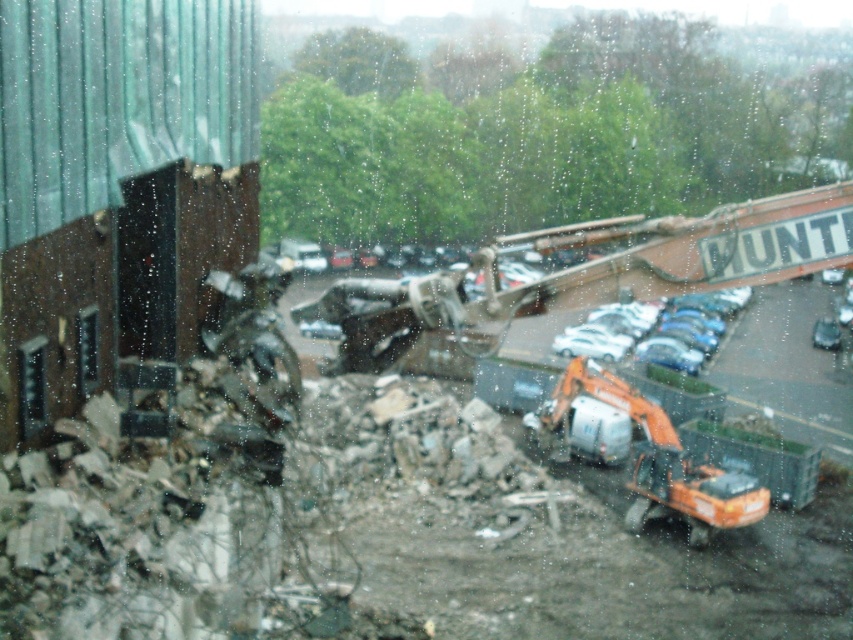
Does orange metallic excavator at lower right appear on the right side of shiny silver car at center?

In fact, orange metallic excavator at lower right is to the left of shiny silver car at center.

Does orange metallic excavator at lower right have a larger size compared to shiny silver car at center?

Incorrect, orange metallic excavator at lower right is not larger than shiny silver car at center.

Where is `orange metallic excavator at lower right`? orange metallic excavator at lower right is located at coordinates coord(651,456).

Image resolution: width=853 pixels, height=640 pixels. In order to click on orange metallic excavator at lower right in this screenshot , I will do `click(651, 456)`.

Is orange metallic excavator at center to the left of shiny silver car at center from the viewer's perspective?

Correct, you'll find orange metallic excavator at center to the left of shiny silver car at center.

Does orange metallic excavator at center have a lesser width compared to shiny silver car at center?

Yes.

I want to click on orange metallic excavator at center, so point(590,273).

Between point (843, 225) and point (703, 544), which one is positioned in front?

Point (843, 225) is more forward.

Is orange metallic excavator at center wider than orange metallic excavator at lower right?

Yes, orange metallic excavator at center is wider than orange metallic excavator at lower right.

Between point (802, 220) and point (646, 401), which one is positioned behind?

The point (646, 401) is behind.

Where is `orange metallic excavator at center`? The height and width of the screenshot is (640, 853). orange metallic excavator at center is located at coordinates (590, 273).